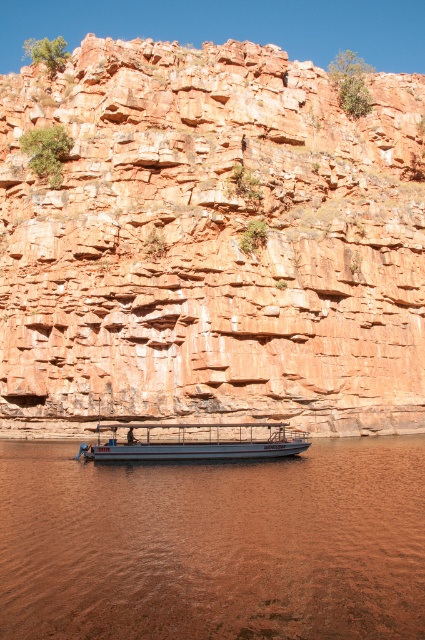
You are a hiker who wants to cross from the matte orange rock at center to the metallic gray boat at center. Given that your maximum jump distance is 20 meters, can you make the jump? Please explain your reasoning.

The distance between the matte orange rock at center and the metallic gray boat at center is 23.71 meters. Since your maximum jump distance is 20 meters, you cannot make the jump as it exceeds your capability by 3.71 meters.

You are a hiker who wants to cross from the matte orange rock at center to the brown matte water at lower center. Given that your backpack has a weight limit of 30 kilograms, and you need to carry enough water for the trip, can you safely make the journey?

The distance between the matte orange rock at center and the brown matte water at lower center is 29.53 meters. Since the backpack can carry up to 30 kilograms, and assuming you need to carry enough water for the trip, it is feasible to safely make the journey as the distance is manageable within the weight limit.

You are a photographer planning to capture the brown matte water at lower center and the metallic gray boat at center in a single shot. Which object should you frame wider to ensure both are fully visible?

The brown matte water at lower center is wider than the metallic gray boat at center, so you should frame the brown matte water at lower center wider to ensure both are fully visible.